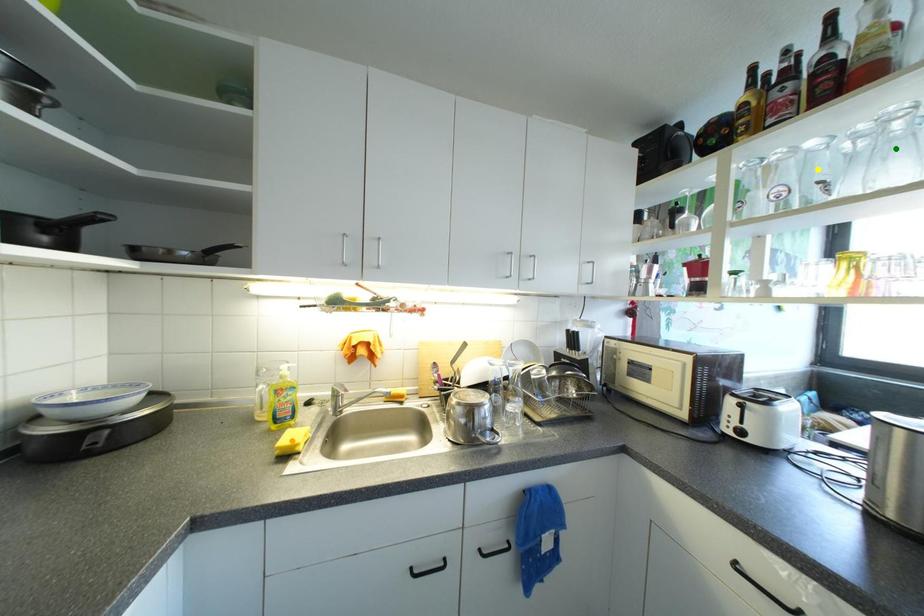
Order these from nearest to farthest:
yellow point
green point
orange point

green point
yellow point
orange point